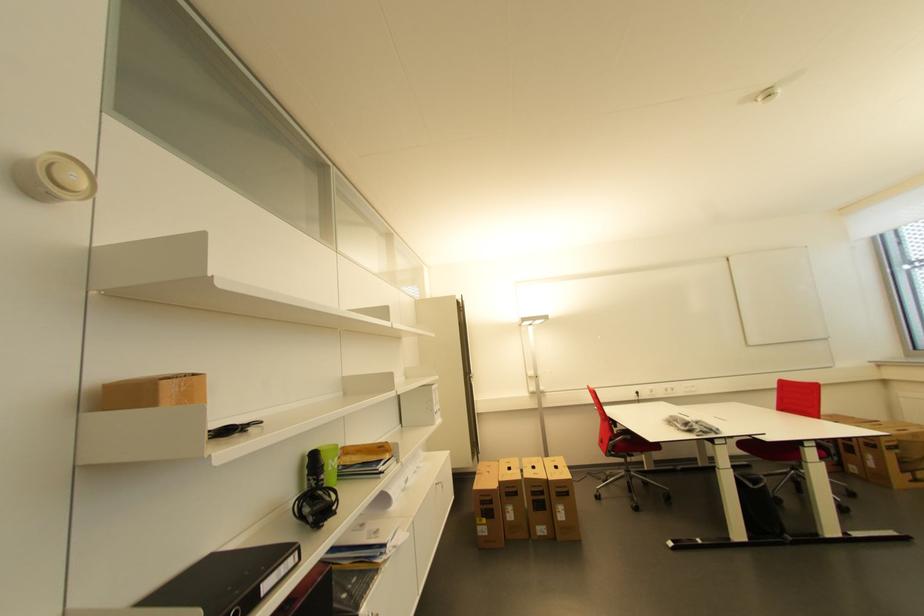
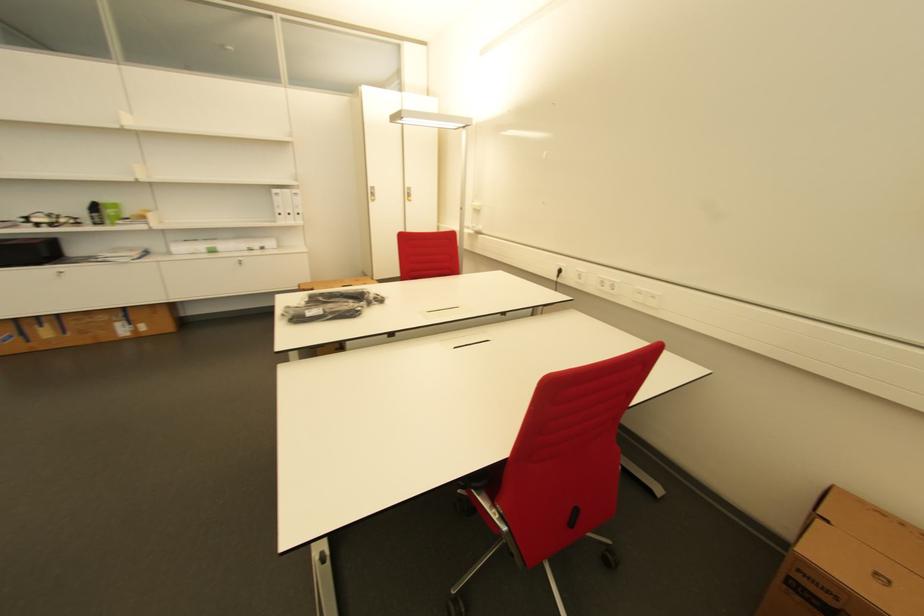
In the second image, find the point that corresponds to (x=327, y=459) in the first image.

(104, 208)